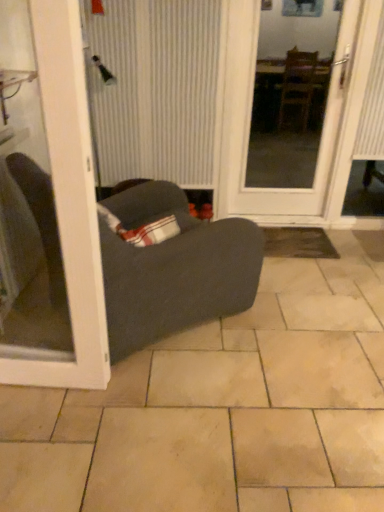
Image resolution: width=384 pixels, height=512 pixels. What are the coordinates of `empty space that is to the right of white glossy door at left, arranged as the 1th door when viewed from the left` in the screenshot? It's located at pos(132,395).